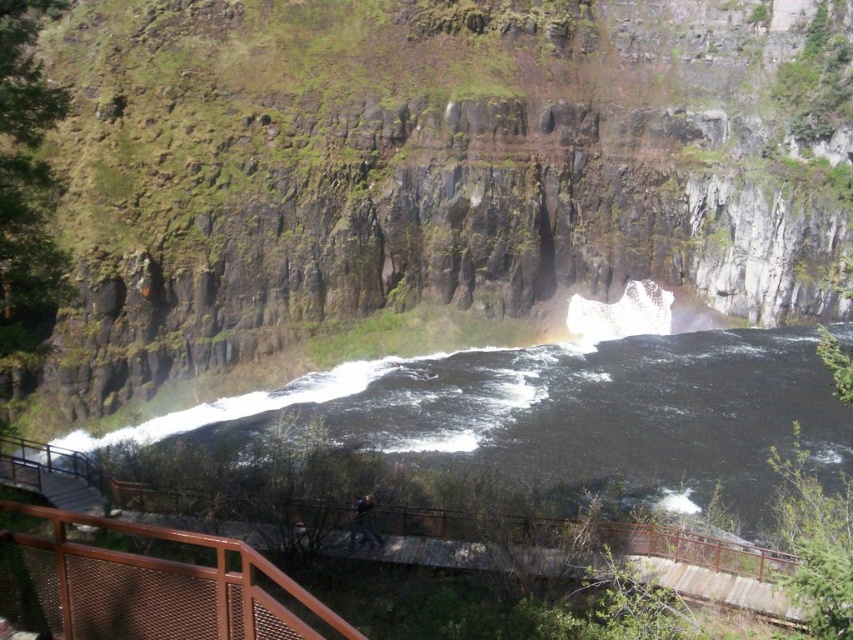
Which is in front, point (746, 189) or point (225, 573)?

Point (225, 573) is more forward.

Which is behind, point (352, 68) or point (189, 588)?

Positioned behind is point (352, 68).

Identify the location of green mossy rock at upper center. (422, 176).

Does black water at center appear under metal mesh railing at lower center?

Incorrect, black water at center is not positioned below metal mesh railing at lower center.

Can you confirm if black water at center is shorter than metal mesh railing at lower center?

No, black water at center is not shorter than metal mesh railing at lower center.

Measure the distance between point (445,419) and camera.

Point (445,419) is 64.07 meters from camera.

This screenshot has height=640, width=853. I want to click on black water at center, so click(x=569, y=413).

Is green mossy rock at upper center taller than brown metal/rail at center?

Correct, green mossy rock at upper center is much taller as brown metal/rail at center.

Can you confirm if green mossy rock at upper center is thinner than brown metal/rail at center?

In fact, green mossy rock at upper center might be wider than brown metal/rail at center.

Which is in front, point (526, 204) or point (293, 509)?

Point (293, 509)

Locate an element on the screen. The width and height of the screenshot is (853, 640). green mossy rock at upper center is located at coordinates (422, 176).